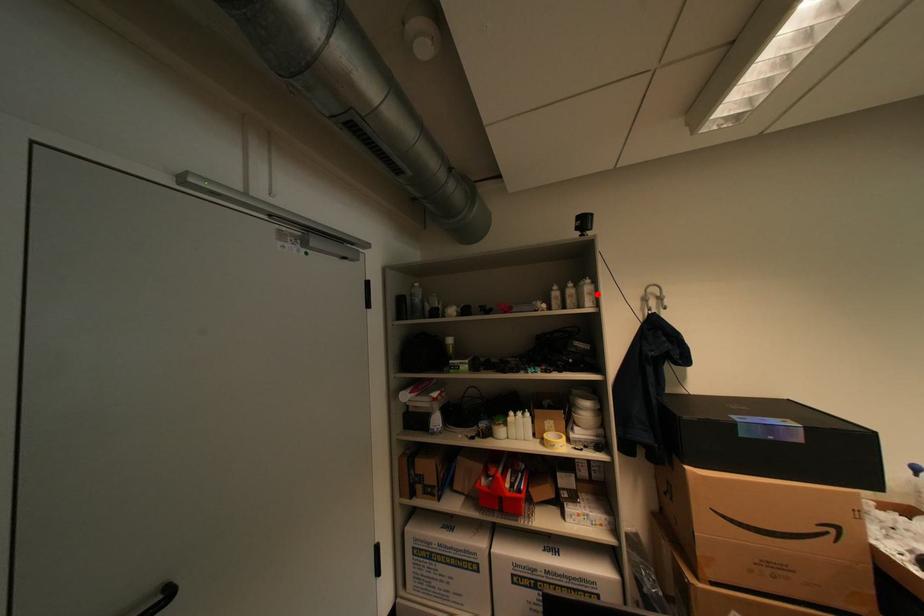
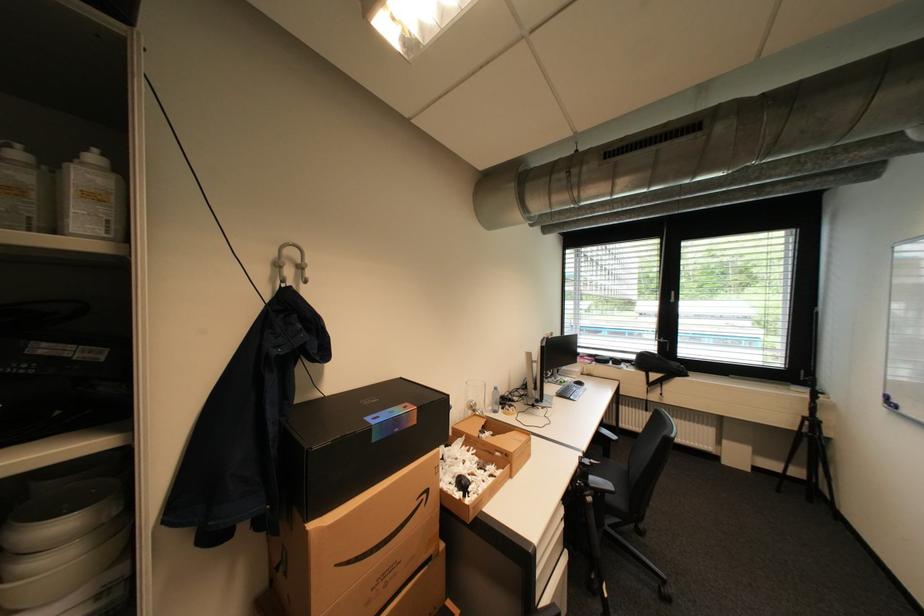
Find the pixel in the second image that matches the highlighted location in the first image.

(100, 197)